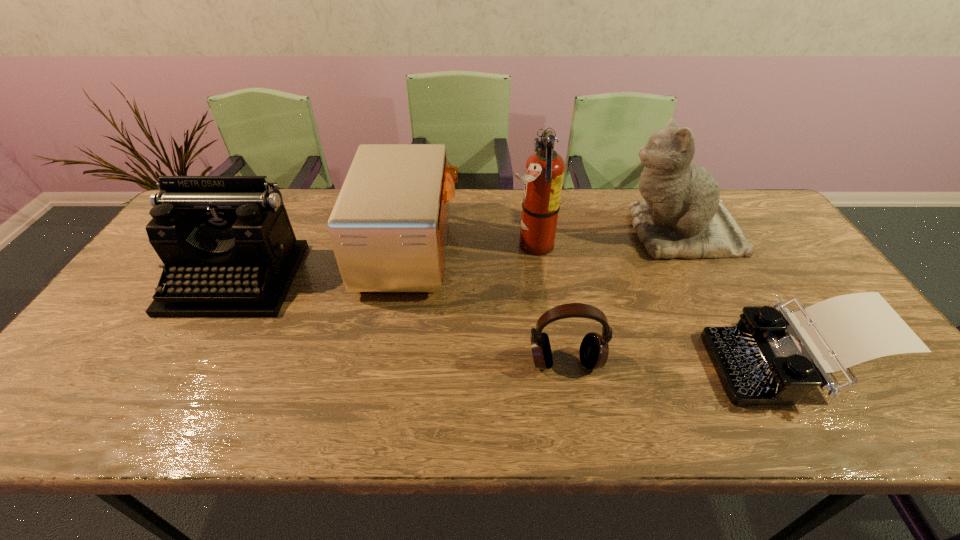
At what (x,y) coordinates should I click in order to perform the action: click on fire extinguisher. Please return your answer as a coordinate pair (x, y). This screenshot has height=540, width=960. Looking at the image, I should click on (543, 178).

Find the location of `cat`. cat is located at coordinates (682, 216).

Image resolution: width=960 pixels, height=540 pixels. Identify the location of the leftmost object. (229, 250).

Identify the location of the left typewriter. (229, 250).

This screenshot has height=540, width=960. In order to click on toaster oven in this screenshot , I will do `click(388, 228)`.

Where is `headset`? headset is located at coordinates (594, 349).

The image size is (960, 540). In order to click on the right typewriter in this screenshot , I will do `click(773, 356)`.

You are a GUI agent. You are given a task and a screenshot of the screen. Output one action in this format:
    pyautogui.click(x=<x>, y=<y>)
    Task: Click on the nearer typewriter
    This screenshot has height=540, width=960.
    Given the screenshot: What is the action you would take?
    pyautogui.click(x=773, y=356)

The width and height of the screenshot is (960, 540). Identify the location of free region located from the nozzle of the fire extinguisher. (383, 245).

I want to click on blank space located from the nozzle of the fire extinguisher, so click(x=409, y=245).